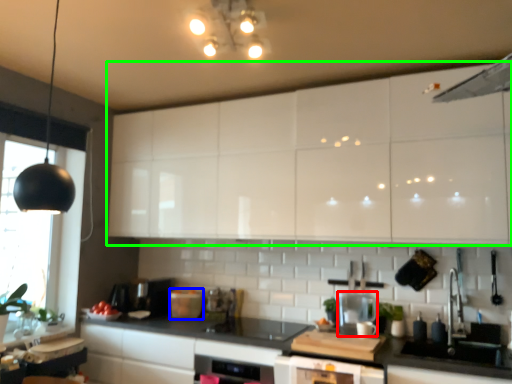
Question: Estimate the real-world distances between objects in this image. Which object is farther from appliance (highlighted by a red box), appliance (highlighted by a blue box) or cabinetry (highlighted by a green box)?

Choices:
 (A) appliance
 (B) cabinetry

Answer: (A)